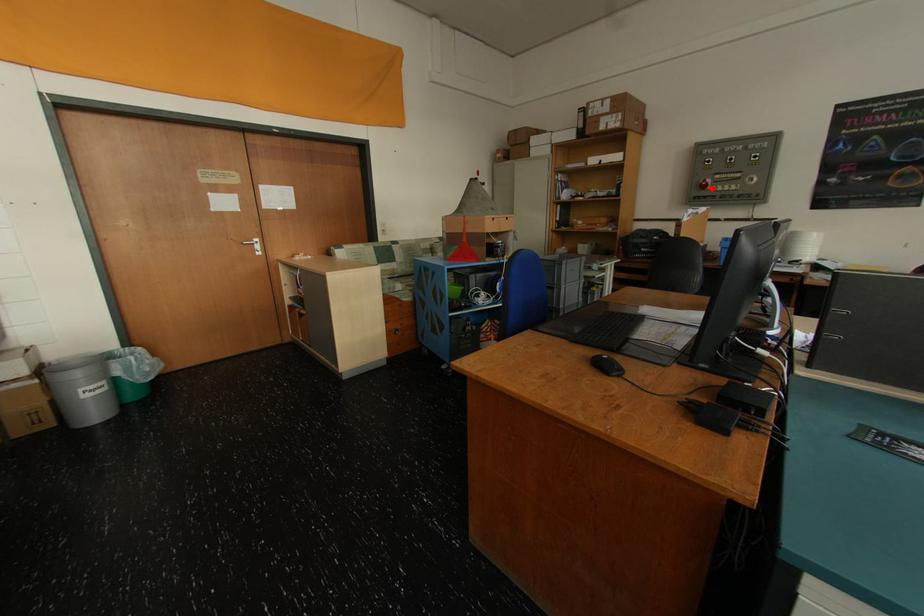
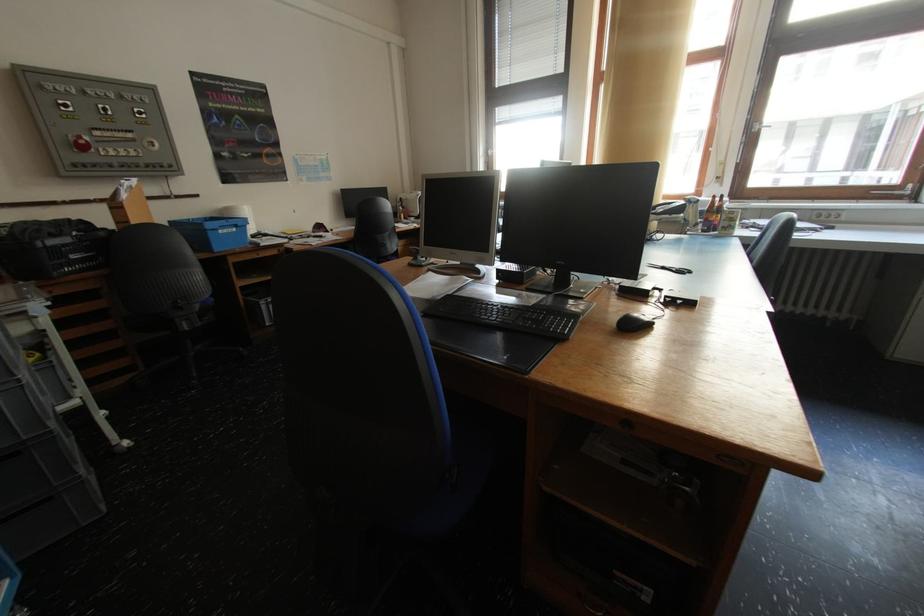
Question: I am providing you with two images of the same scene from different viewpoints. A red point is shown in image1. For the corresponding object point in image2, is it positioned nearer or farther from the camera?

Choices:
 (A) Nearer
 (B) Farther

Answer: (B)